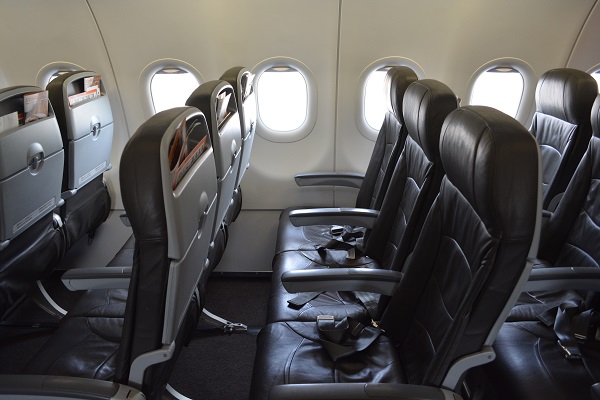
The width and height of the screenshot is (600, 400). Identify the location of visible back of seats. (33, 171), (93, 142), (193, 222), (231, 165), (250, 139).